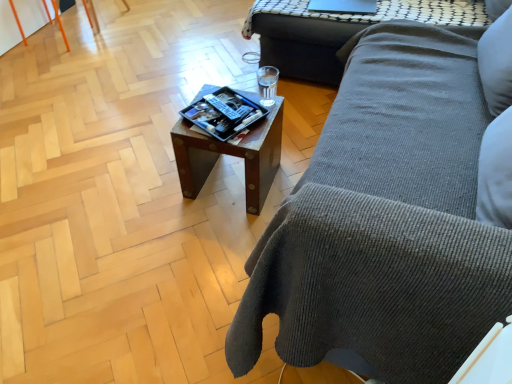
Find the location of a particular element. The width and height of the screenshot is (512, 384). blank space situated above wooden tray at center, acting as the 2th table starting from the right (from a real-world perspective) is located at coordinates (236, 123).